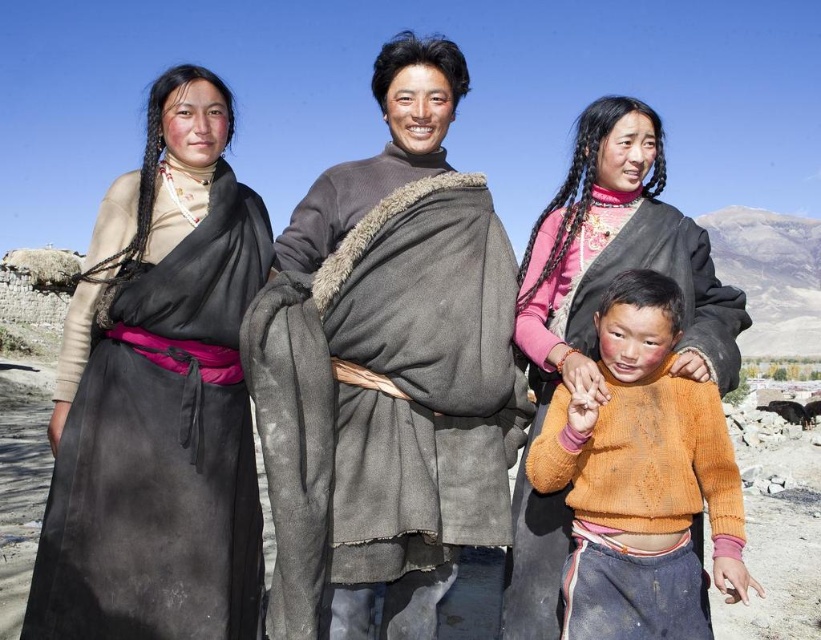
Between gray woolen robe at center and orange knitted sweater at center, which one is positioned lower?

orange knitted sweater at center is lower down.

Consider the image. Can you confirm if gray woolen robe at center is wider than orange knitted sweater at center?

Indeed, gray woolen robe at center has a greater width compared to orange knitted sweater at center.

Between point (328, 332) and point (571, 611), which one is positioned behind?

Point (328, 332)

At what (x,y) coordinates should I click in order to perform the action: click on gray woolen robe at center. Please return your answer as a coordinate pair (x, y). Image resolution: width=821 pixels, height=640 pixels. Looking at the image, I should click on 388,371.

Which is behind, point (242, 253) or point (680, 484)?

Point (242, 253)

Is matte black robe at left positioned in front of orange knitted sweater at center?

No, matte black robe at left is further to the viewer.

Between point (168, 547) and point (558, 422), which one is positioned in front?

Point (168, 547) is in front.

Identify the location of matte black robe at left. (158, 397).

Is point (475, 243) farther from camera compared to point (172, 602)?

Yes, point (475, 243) is behind point (172, 602).

Does gray woolen robe at center have a lesser height compared to matte black robe at left?

No.

Is point (429, 288) positioned in front of point (85, 564)?

No, (429, 288) is behind (85, 564).

In order to click on gray woolen robe at center in this screenshot , I will do `click(388, 371)`.